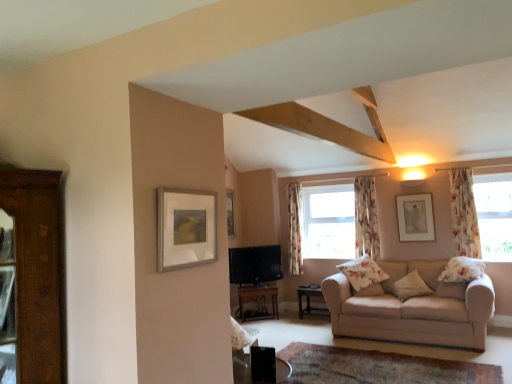
The image size is (512, 384). What do you see at coordinates (329, 222) in the screenshot? I see `clear glass window at center, which is the 1th window from left to right` at bounding box center [329, 222].

What do you see at coordinates (410, 286) in the screenshot? I see `white fabric pillow at center, placed as the 2th pillow when sorted from right to left` at bounding box center [410, 286].

What is the approximate width of matte silver picture frame at upper right, which ranks as the first picture frame in right-to-left order?

matte silver picture frame at upper right, which ranks as the first picture frame in right-to-left order, is 1.70 inches wide.

What are the coordinates of `matte silver picture frame at upper right, positioned as the second picture frame in front-to-back order` in the screenshot? It's located at (415, 217).

Identify the location of clear glass window at center, which is the 1th window from left to right. (329, 222).

Is wooden table at center, the second table from the right, far away from beige fabric couch at lower right?

Absolutely, wooden table at center, the second table from the right, is distant from beige fabric couch at lower right.

Consider the image. From the image's perspective, is wooden table at center, the 1th table in the left-to-right sequence, located above beige fabric couch at lower right?

No, from the image's perspective, wooden table at center, the 1th table in the left-to-right sequence, is not over beige fabric couch at lower right.

Who is bigger, wooden table at center, the 1th table in the left-to-right sequence, or beige fabric couch at lower right?

With larger size is beige fabric couch at lower right.

Is matte silver picture frame at upper right, the 2th picture frame positioned from the left, not near wooden table at center, the 1th table in the left-to-right sequence?

Yes, matte silver picture frame at upper right, the 2th picture frame positioned from the left, and wooden table at center, the 1th table in the left-to-right sequence, are located far from each other.

From a real-world perspective, is matte silver picture frame at upper right, which appears as the first picture frame when viewed from the back, above or below wooden table at center, the 1th table in the left-to-right sequence?

In terms of real-world spatial position, matte silver picture frame at upper right, which appears as the first picture frame when viewed from the back, is above wooden table at center, the 1th table in the left-to-right sequence.

I want to click on picture frame that is the 1st object located in front of the wooden table at center, the second table from the right, so click(415, 217).

Is matte silver picture frame at upper right, the 2th picture frame positioned from the left, positioned behind wooden table at center, the 1th table in the left-to-right sequence?

No, it is in front of wooden table at center, the 1th table in the left-to-right sequence.

In the scene shown: In the image, is wooden table at center, positioned as the 2th table in left-to-right order, positioned in front of or behind floral fabric curtain at right, the 1th curtain when ordered from right to left?

wooden table at center, positioned as the 2th table in left-to-right order, is positioned farther from the viewer than floral fabric curtain at right, the 1th curtain when ordered from right to left.

Is floral fabric curtain at right, the 3th curtain positioned from the back, completely or partially inside wooden table at center, positioned as the 2th table in left-to-right order?

That's incorrect, floral fabric curtain at right, the 3th curtain positioned from the back, is not inside wooden table at center, positioned as the 2th table in left-to-right order.

In terms of width, does wooden table at center, positioned as the 2th table in left-to-right order, look wider or thinner when compared to floral fabric curtain at right, the 1th curtain when ordered from right to left?

In the image, wooden table at center, positioned as the 2th table in left-to-right order, appears to be wider than floral fabric curtain at right, the 1th curtain when ordered from right to left.

Considering the positions of point (305, 295) and point (460, 202), is point (305, 295) closer or farther from the camera than point (460, 202)?

Point (305, 295) is positioned closer to the camera compared to point (460, 202).

From the image's perspective, which is below, beige fabric couch at lower right or floral fabric pillow at right, which ranks as the 1th pillow in right-to-left order?

From the image's view, beige fabric couch at lower right is below.

Between beige fabric couch at lower right and floral fabric pillow at right, which is counted as the 3th pillow, starting from the left, which one has larger size?

Bigger between the two is beige fabric couch at lower right.

Would you say beige fabric couch at lower right is inside or outside floral fabric pillow at right, which ranks as the 1th pillow in right-to-left order?

beige fabric couch at lower right is not enclosed by floral fabric pillow at right, which ranks as the 1th pillow in right-to-left order.

From a real-world perspective, is beige fabric couch at lower right on top of floral fabric pillow at right, which ranks as the 1th pillow in right-to-left order?

Actually, beige fabric couch at lower right is physically below floral fabric pillow at right, which ranks as the 1th pillow in right-to-left order, in the real world.

Is floral fabric curtain at right, the 1th curtain when ordered from right to left, oriented towards floral fabric curtain at center, the 2th curtain positioned from the right?

No, floral fabric curtain at right, the 1th curtain when ordered from right to left, is not oriented towards floral fabric curtain at center, the 2th curtain positioned from the right.

From a real-world perspective, is floral fabric curtain at right, the 1th curtain in the front-to-back sequence, on floral fabric curtain at center, marked as the second curtain in a back-to-front arrangement?

Correct, in the physical world, floral fabric curtain at right, the 1th curtain in the front-to-back sequence, is higher than floral fabric curtain at center, marked as the second curtain in a back-to-front arrangement.

How different are the orientations of floral fabric curtain at right, the 3th curtain when ordered from left to right, and floral fabric curtain at center, the 2th curtain from the left, in degrees?

The facing directions of floral fabric curtain at right, the 3th curtain when ordered from left to right, and floral fabric curtain at center, the 2th curtain from the left, are 0.00258 degrees apart.

In the scene shown: Which is more to the right, floral fabric curtain at right, the 1th curtain in the front-to-back sequence, or floral fabric curtain at center, the 2th curtain from the front?

Positioned to the right is floral fabric curtain at right, the 1th curtain in the front-to-back sequence.

Between floral fabric curtain at right, the 1th curtain in the front-to-back sequence, and wooden table at center, the second table from the right, which one has smaller size?

floral fabric curtain at right, the 1th curtain in the front-to-back sequence.

Find the location of a particular element. The image size is (512, 384). curtain that is the 3rd one when counting rightward from the wooden table at center, the 1th table in the left-to-right sequence is located at coordinates (464, 213).

Can you confirm if floral fabric curtain at right, the 3th curtain when ordered from left to right, is thinner than wooden table at center, the 1th table in the left-to-right sequence?

Indeed, floral fabric curtain at right, the 3th curtain when ordered from left to right, has a lesser width compared to wooden table at center, the 1th table in the left-to-right sequence.

In the scene shown: Which is nearer, (453, 185) or (259, 288)?

Positioned in front is point (259, 288).

Consider the image. Is wooden table at center, which is the first table from right to left, directly adjacent to floral fabric curtain at center, marked as the first curtain in a left-to-right arrangement?

wooden table at center, which is the first table from right to left, is not next to floral fabric curtain at center, marked as the first curtain in a left-to-right arrangement, and they're not touching.

From a real-world perspective, is wooden table at center, which is the first table from right to left, positioned above or below floral fabric curtain at center, which is counted as the third curtain, starting from the front?

Clearly, from a real-world perspective, wooden table at center, which is the first table from right to left, is below floral fabric curtain at center, which is counted as the third curtain, starting from the front.

Could you tell me if wooden table at center, which is the first table from right to left, is turned towards floral fabric curtain at center, which ranks as the 1th curtain in back-to-front order?

No.

Which of these two, wooden table at center, which is the first table from right to left, or floral fabric curtain at center, which ranks as the 1th curtain in back-to-front order, stands taller?

With more height is floral fabric curtain at center, which ranks as the 1th curtain in back-to-front order.

Image resolution: width=512 pixels, height=384 pixels. I want to click on studio couch that is above the wooden table at center, the second table from the right (from a real-world perspective), so click(x=413, y=308).

Image resolution: width=512 pixels, height=384 pixels. There is a wooden table at center, the second table from the right. Identify the location of the 1st picture frame above it (from the image's perspective). (415, 217).

Looking at the image, which one is located further to clear glass window at center, which appears as the 1th window when viewed from the back, floral fabric curtain at center, the 2th curtain from the front, or matte silver picture frame at upper right, positioned as the second picture frame in front-to-back order?

matte silver picture frame at upper right, positioned as the second picture frame in front-to-back order, is positioned further to the anchor clear glass window at center, which appears as the 1th window when viewed from the back.

Looking at this image, based on their spatial positions, is floral fabric curtain at center, the third curtain positioned from the right, or floral fabric pillow at right, which is counted as the 3th pillow, starting from the left, further from beige fabric couch at lower right?

floral fabric curtain at center, the third curtain positioned from the right, is positioned further to the anchor beige fabric couch at lower right.

Which object lies nearer to the anchor point white fabric pillow at center, the 2th pillow when ordered from left to right, beige fabric couch at lower right or matte black tv at center?

beige fabric couch at lower right.

Which object lies further to the anchor point floral fabric curtain at right, the 1th curtain in the front-to-back sequence, matte silver picture frame at upper left, the second picture frame from the right, or floral fabric curtain at center, which is counted as the third curtain, starting from the front?

Among the two, matte silver picture frame at upper left, the second picture frame from the right, is located further to floral fabric curtain at right, the 1th curtain in the front-to-back sequence.

Which object lies further to the anchor point wooden table at center, positioned as the 2th table in left-to-right order, floral fabric curtain at right, the 3th curtain when ordered from left to right, or floral fabric pillow at center, marked as the 1th pillow in a left-to-right arrangement?

Among the two, floral fabric curtain at right, the 3th curtain when ordered from left to right, is located further to wooden table at center, positioned as the 2th table in left-to-right order.

Based on the photo, which object lies further to the anchor point floral fabric curtain at center, the third curtain positioned from the right, clear glass window at center, arranged as the second window when viewed from the right, or floral fabric curtain at center, the 2th curtain from the left?

floral fabric curtain at center, the 2th curtain from the left, is further to floral fabric curtain at center, the third curtain positioned from the right.

From the image, which object appears to be nearer to floral fabric curtain at right, the 1th curtain in the front-to-back sequence, matte black tv at center or clear glass window at center, arranged as the second window when viewed from the right?

The object closer to floral fabric curtain at right, the 1th curtain in the front-to-back sequence, is clear glass window at center, arranged as the second window when viewed from the right.

When comparing their distances from matte silver picture frame at upper right, which appears as the first picture frame when viewed from the back, does floral fabric pillow at center, arranged as the 3th pillow when viewed from the right, or floral fabric curtain at center, the 2th curtain from the left, seem closer?

Based on the image, floral fabric curtain at center, the 2th curtain from the left, appears to be nearer to matte silver picture frame at upper right, which appears as the first picture frame when viewed from the back.

The width and height of the screenshot is (512, 384). What are the coordinates of `curtain between wooden table at center, the 1th table in the left-to-right sequence, and floral fabric pillow at center, marked as the 1th pillow in a left-to-right arrangement` in the screenshot? It's located at (295, 228).

You are a GUI agent. You are given a task and a screenshot of the screen. Output one action in this format:
    pyautogui.click(x=<x>, y=<y>)
    Task: Click on the table between wooden table at center, the 1th table in the left-to-right sequence, and floral fabric pillow at center, marked as the 1th pillow in a left-to-right arrangement, from left to right
    The width and height of the screenshot is (512, 384).
    Given the screenshot: What is the action you would take?
    pyautogui.click(x=309, y=299)

Locate an element on the screen. studio couch between matte silver picture frame at upper left, which is counted as the first picture frame, starting from the left, and matte black tv at center from front to back is located at coordinates (413, 308).

Locate an element on the screen. curtain between beige fabric couch at lower right and matte silver picture frame at upper right, which ranks as the first picture frame in right-to-left order, along the z-axis is located at coordinates (464, 213).